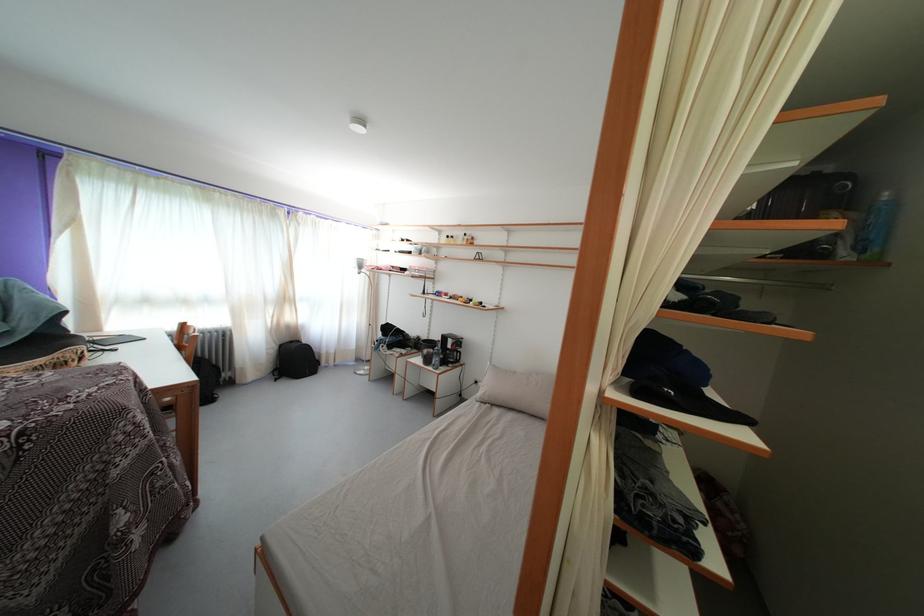
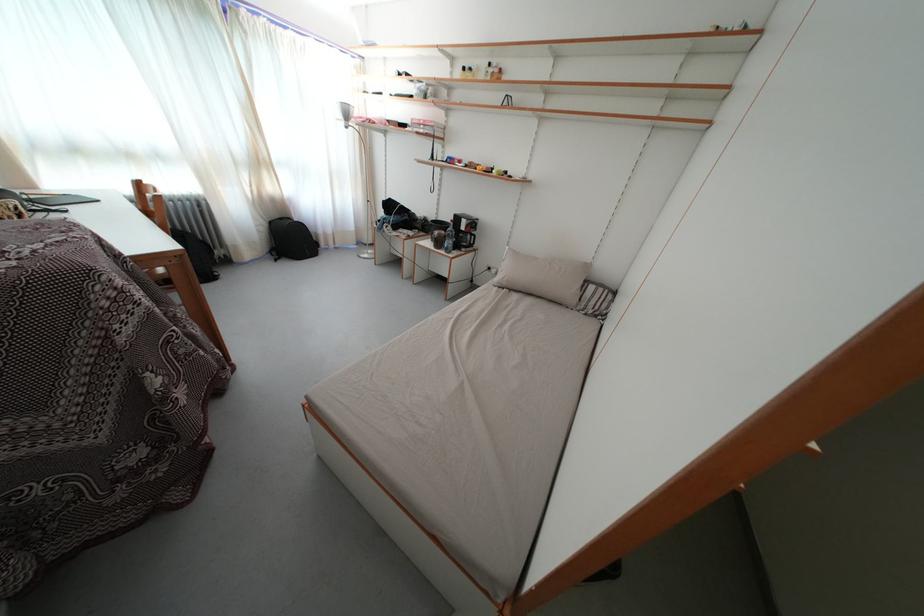
Which direction would the cameraman need to move to produce the second image?

The cameraman moved toward left, forward.